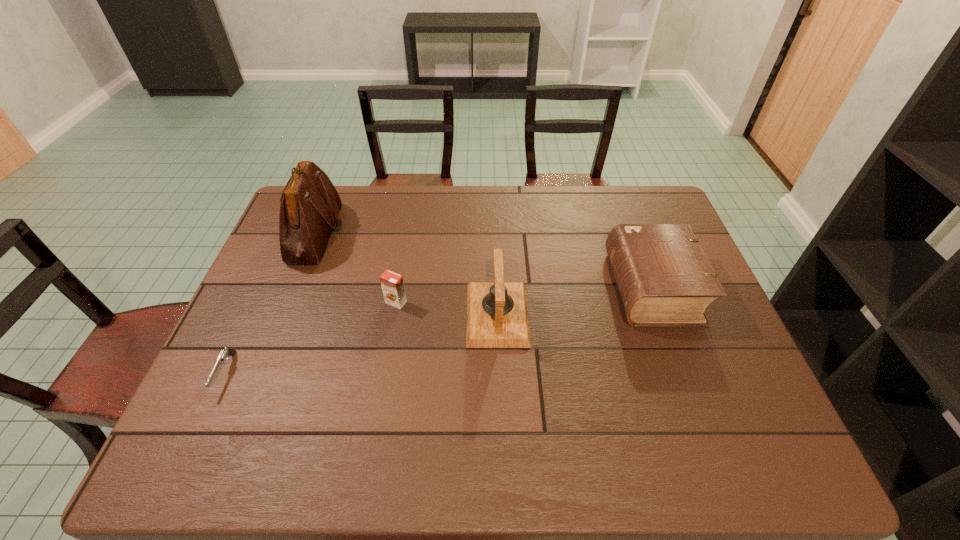
The height and width of the screenshot is (540, 960). Identify the location of free region located on the spine side of the Bible. (473, 287).

What are the coordinates of `vacant position located 0.150m on the spine side of the Bible` in the screenshot? It's located at (560, 287).

This screenshot has height=540, width=960. Identify the location of vacant space located on the spine side of the Bible. (x=540, y=287).

The width and height of the screenshot is (960, 540). I want to click on free region located on the right of the orange juice, so click(x=449, y=302).

Locate an element on the screen. This screenshot has width=960, height=540. vacant space located on the front-facing side of the shortest object is located at coordinates (205, 416).

The width and height of the screenshot is (960, 540). I want to click on object located at the far edge, so click(310, 206).

The height and width of the screenshot is (540, 960). Find the location of `shoulder bag present at the left edge`. shoulder bag present at the left edge is located at coordinates (310, 206).

Find the location of a particular element. The image size is (960, 540). pistol that is at the left edge is located at coordinates (225, 353).

Locate an element on the screen. The width and height of the screenshot is (960, 540). object located at the right edge is located at coordinates click(x=664, y=278).

I want to click on object that is at the far left corner, so 310,206.